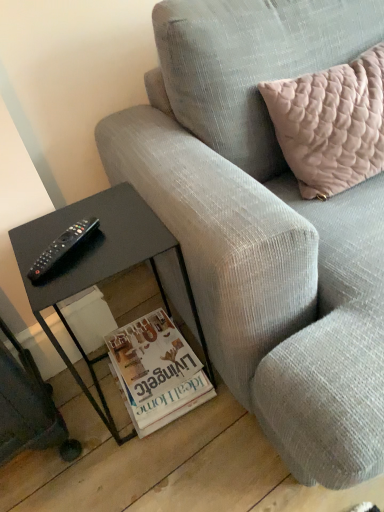
Where is `vacant space situated on the left part of white glossy magazine at lower center`? vacant space situated on the left part of white glossy magazine at lower center is located at coordinates (81, 409).